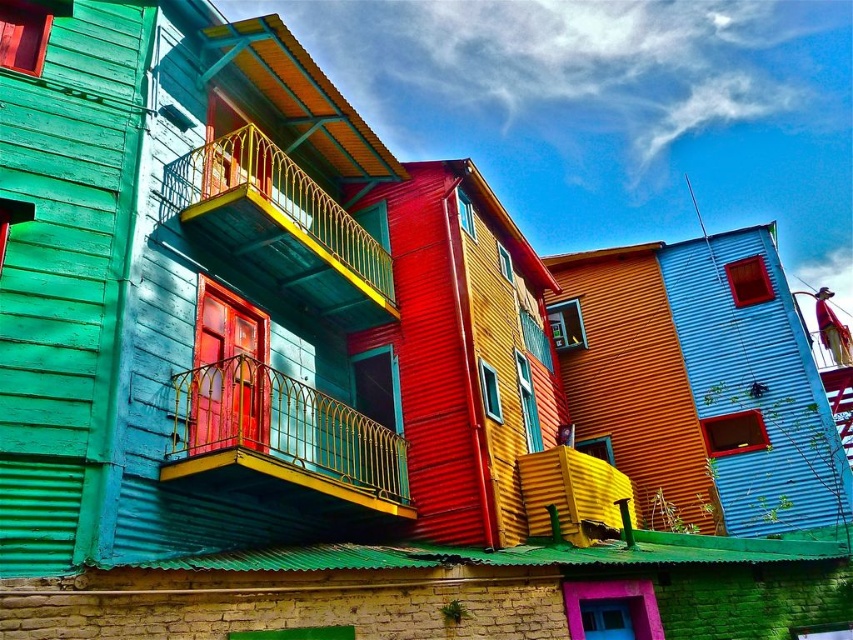
Question: Is gold wrought iron balcony at center bigger than yellow metal railing at upper left?

Choices:
 (A) yes
 (B) no

Answer: (B)

Question: Which of the following is the closest to the observer?

Choices:
 (A) (317, 426)
 (B) (381, 282)

Answer: (A)

Question: Which object appears farthest from the camera in this image?

Choices:
 (A) gold wrought iron balcony at center
 (B) yellow metal railing at upper left

Answer: (B)

Question: Can you confirm if gold wrought iron balcony at center is positioned to the left of yellow metal railing at upper left?

Choices:
 (A) yes
 (B) no

Answer: (B)

Question: Is gold wrought iron balcony at center bigger than yellow metal railing at upper left?

Choices:
 (A) no
 (B) yes

Answer: (A)